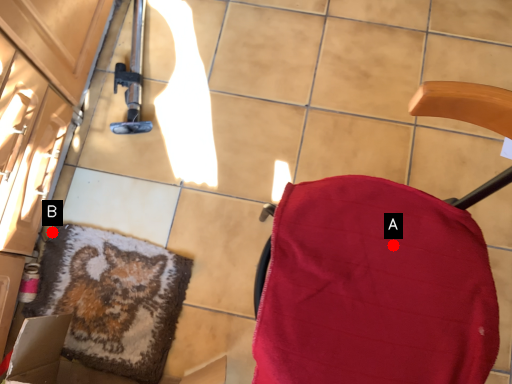
Question: Two points are circled on the image, labeled by A and B beside each circle. Which point is closer to the camera?

Choices:
 (A) A is closer
 (B) B is closer

Answer: (A)